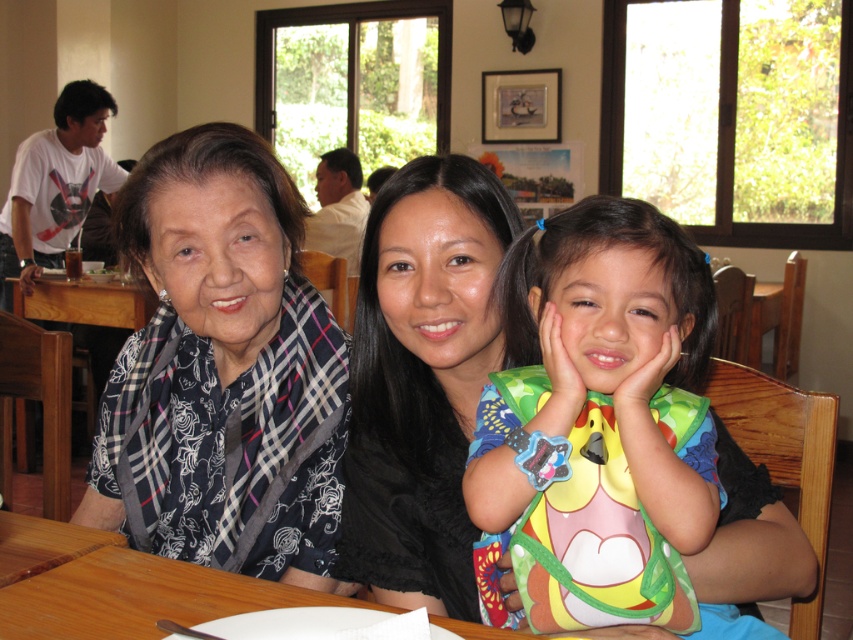
Can you confirm if matte black blouse at center is wider than multicolored fabric bib at center?

In fact, matte black blouse at center might be narrower than multicolored fabric bib at center.

Who is taller, matte black blouse at center or multicolored fabric bib at center?

With more height is matte black blouse at center.

Describe the element at coordinates (421, 380) in the screenshot. I see `matte black blouse at center` at that location.

You are a GUI agent. You are given a task and a screenshot of the screen. Output one action in this format:
    pyautogui.click(x=<x>, y=<y>)
    Task: Click on the matte black blouse at center
    The width and height of the screenshot is (853, 640).
    Given the screenshot: What is the action you would take?
    pyautogui.click(x=421, y=380)

Who is positioned more to the right, plaid fabric shawl at left or matte black blouse at center?

Positioned to the right is matte black blouse at center.

Between point (193, 310) and point (405, 189), which one is positioned behind?

The point (193, 310) is behind.

This screenshot has width=853, height=640. Find the location of `plaid fabric shawl at left`. plaid fabric shawl at left is located at coordinates (238, 355).

Is point (386, 435) closer to camera compared to point (70, 580)?

No, it is not.

The width and height of the screenshot is (853, 640). Describe the element at coordinates (421, 380) in the screenshot. I see `matte black blouse at center` at that location.

The image size is (853, 640). In order to click on matte black blouse at center in this screenshot , I will do `click(421, 380)`.